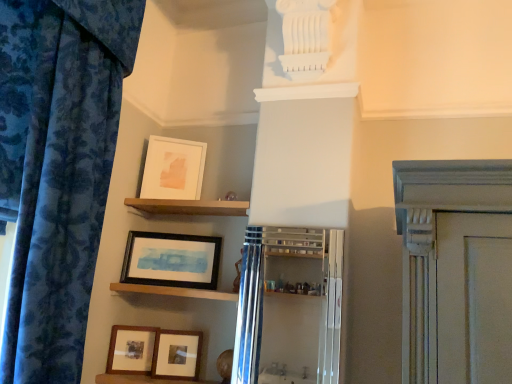
Question: Is matte black picture frame at lower left, the 2th picture frame positioned from the bottom, to the right of wooden shelf at upper center, arranged as the 2th shelf when ordered from the bottom, from the viewer's perspective?

Choices:
 (A) yes
 (B) no

Answer: (B)

Question: Is matte black picture frame at lower left, the 2th picture frame positioned from the bottom, smaller than wooden shelf at upper center, arranged as the 2th shelf when ordered from the bottom?

Choices:
 (A) no
 (B) yes

Answer: (B)

Question: From a real-world perspective, is matte black picture frame at lower left, the 2th picture frame positioned from the bottom, physically above wooden shelf at upper center, the first shelf in the top-to-bottom sequence?

Choices:
 (A) yes
 (B) no

Answer: (B)

Question: Does matte black picture frame at lower left, the 3th picture frame in the top-to-bottom sequence, have a greater width compared to wooden shelf at upper center, arranged as the 2th shelf when ordered from the bottom?

Choices:
 (A) no
 (B) yes

Answer: (A)

Question: Is matte black picture frame at lower left, the 2th picture frame positioned from the bottom, to the left of wooden shelf at upper center, the first shelf in the top-to-bottom sequence, from the viewer's perspective?

Choices:
 (A) yes
 (B) no

Answer: (A)

Question: Is matte black picture frame at lower left, the 2th picture frame positioned from the bottom, aimed at wooden shelf at upper center, the first shelf in the top-to-bottom sequence?

Choices:
 (A) yes
 (B) no

Answer: (B)

Question: Can you confirm if wooden shelf at upper center, the first shelf in the top-to-bottom sequence, is bigger than wooden matte picture frame at lower center, which ranks as the fourth picture frame in top-to-bottom order?

Choices:
 (A) no
 (B) yes

Answer: (B)

Question: Considering the relative positions of wooden shelf at upper center, the first shelf in the top-to-bottom sequence, and wooden matte picture frame at lower center, which ranks as the fourth picture frame in top-to-bottom order, in the image provided, is wooden shelf at upper center, the first shelf in the top-to-bottom sequence, behind wooden matte picture frame at lower center, which ranks as the fourth picture frame in top-to-bottom order,?

Choices:
 (A) yes
 (B) no

Answer: (B)

Question: Considering the relative positions of wooden shelf at upper center, the first shelf in the top-to-bottom sequence, and wooden matte picture frame at lower center, which ranks as the fourth picture frame in top-to-bottom order, in the image provided, is wooden shelf at upper center, the first shelf in the top-to-bottom sequence, to the right of wooden matte picture frame at lower center, which ranks as the fourth picture frame in top-to-bottom order, from the viewer's perspective?

Choices:
 (A) no
 (B) yes

Answer: (B)

Question: Is wooden matte picture frame at lower center, which ranks as the fourth picture frame in top-to-bottom order, completely or partially inside wooden shelf at upper center, the first shelf in the top-to-bottom sequence?

Choices:
 (A) yes
 (B) no

Answer: (B)

Question: Considering the relative sizes of wooden shelf at upper center, arranged as the 2th shelf when ordered from the bottom, and wooden matte picture frame at lower center, which ranks as the fourth picture frame in top-to-bottom order, in the image provided, is wooden shelf at upper center, arranged as the 2th shelf when ordered from the bottom, smaller than wooden matte picture frame at lower center, which ranks as the fourth picture frame in top-to-bottom order,?

Choices:
 (A) yes
 (B) no

Answer: (B)

Question: Would you say wooden shelf at upper center, the first shelf in the top-to-bottom sequence, is a long distance from wooden matte picture frame at lower center, positioned as the first picture frame in bottom-to-top order?

Choices:
 (A) no
 (B) yes

Answer: (A)

Question: Is matte white picture frame at upper center, arranged as the 4th picture frame when ordered from the bottom, facing towards wooden matte picture frame at lower center, which ranks as the fourth picture frame in top-to-bottom order?

Choices:
 (A) no
 (B) yes

Answer: (A)